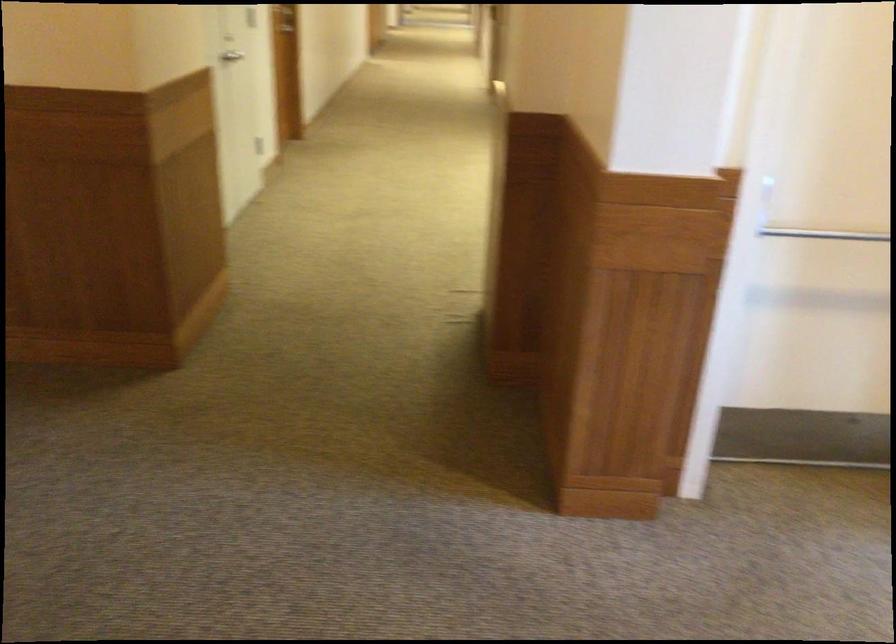
Image resolution: width=896 pixels, height=644 pixels. Identify the location of metal door handle. (231, 55).